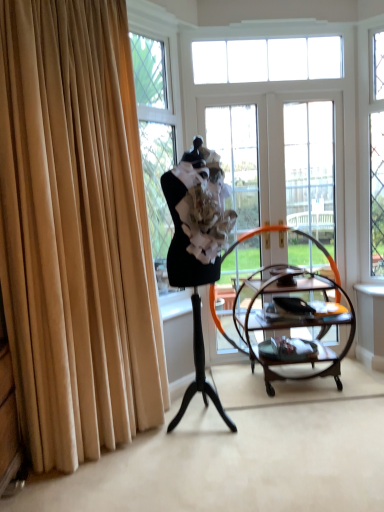
Identify the location of black matte mannequin at center. (196, 248).

At what (x,y) coordinates should I click in order to perform the action: click on mahogany wood serving cart at center. Please return your answer as a coordinate pair (x, y). This screenshot has width=384, height=512. Looking at the image, I should click on (292, 323).

What do you see at coordinates (277, 160) in the screenshot? Image resolution: width=384 pixels, height=512 pixels. I see `clear glass door at center, which is the second glass door from right to left` at bounding box center [277, 160].

Find the location of a particular element. The height and width of the screenshot is (512, 384). black matte mannequin at center is located at coordinates (196, 248).

Is beige velvet curtain at left facing away from black matte mannequin at center?

That's not correct — beige velvet curtain at left is not looking away from black matte mannequin at center.

Is beige velvet curtain at left inside the boundaries of black matte mannequin at center, or outside?

beige velvet curtain at left lies outside black matte mannequin at center.

What's the angular difference between beige velvet curtain at left and black matte mannequin at center's facing directions?

15.3 degrees.

In the scene shown: From a real-world perspective, is beige velvet curtain at left positioned above or below black matte mannequin at center?

In terms of real-world spatial position, beige velvet curtain at left is above black matte mannequin at center.

Who is taller, black matte mannequin at center or clear glass door at center, the second glass door from the left?

With more height is clear glass door at center, the second glass door from the left.

Would you say clear glass door at center, arranged as the first glass door when viewed from the right, is part of black matte mannequin at center's contents?

Definitely not — clear glass door at center, arranged as the first glass door when viewed from the right, is not inside black matte mannequin at center.

Which of these two, black matte mannequin at center or clear glass door at center, arranged as the first glass door when viewed from the right, is wider?

Wider between the two is black matte mannequin at center.

Is clear glass door at center, which is the second glass door from right to left, inside the boundaries of mahogany wood serving cart at center, or outside?

The correct answer is: outside.

Is clear glass door at center, which is the second glass door from right to left, facing away from mahogany wood serving cart at center?

Yes, clear glass door at center, which is the second glass door from right to left, is facing away from mahogany wood serving cart at center.

From a real-world perspective, is clear glass door at center, acting as the 1th glass door starting from the left, positioned over mahogany wood serving cart at center based on gravity?

Yes, from a real-world perspective, clear glass door at center, acting as the 1th glass door starting from the left, is on top of mahogany wood serving cart at center.

How far apart are black matte mannequin at center and clear glass door at center, acting as the 1th glass door starting from the left?

The distance of black matte mannequin at center from clear glass door at center, acting as the 1th glass door starting from the left, is 88.82 centimeters.

Is clear glass door at center, which is the second glass door from right to left, completely or partially inside black matte mannequin at center?

No, black matte mannequin at center does not contain clear glass door at center, which is the second glass door from right to left.

Looking at this image, considering the sizes of objects black matte mannequin at center and clear glass door at center, acting as the 1th glass door starting from the left, in the image provided, who is taller, black matte mannequin at center or clear glass door at center, acting as the 1th glass door starting from the left,?

With more height is clear glass door at center, acting as the 1th glass door starting from the left.

From the picture: Who is smaller, black matte mannequin at center or clear glass door at center, which is the second glass door from right to left?

clear glass door at center, which is the second glass door from right to left, is smaller.

Is clear glass door at center, acting as the 1th glass door starting from the left, directly adjacent to black matte mannequin at center?

clear glass door at center, acting as the 1th glass door starting from the left, and black matte mannequin at center are not in contact.

Which point is more distant from viewer, [269,212] or [190,204]?

The point [269,212] is farther from the camera.

Looking at this image, can you confirm if clear glass door at center, which is the second glass door from right to left, is smaller than black matte mannequin at center?

Correct, clear glass door at center, which is the second glass door from right to left, occupies less space than black matte mannequin at center.

From the image's perspective, which one is positioned lower, clear glass door at center, acting as the 1th glass door starting from the left, or black matte mannequin at center?

black matte mannequin at center appears lower in the image.

Looking at this image, how far apart are mahogany wood serving cart at center and clear glass door at center, the second glass door from the left?

mahogany wood serving cart at center is 61.76 centimeters away from clear glass door at center, the second glass door from the left.

Where is `table that appears below the clear glass door at center, the second glass door from the left (from a real-world perspective)`? table that appears below the clear glass door at center, the second glass door from the left (from a real-world perspective) is located at coordinates (292, 323).

Considering the sizes of objects mahogany wood serving cart at center and clear glass door at center, the second glass door from the left, in the image provided, who is bigger, mahogany wood serving cart at center or clear glass door at center, the second glass door from the left,?

mahogany wood serving cart at center is bigger.

In terms of width, does mahogany wood serving cart at center look wider or thinner when compared to clear glass door at center, the second glass door from the left?

In the image, mahogany wood serving cart at center appears to be wider than clear glass door at center, the second glass door from the left.

How many degrees apart are the facing directions of clear glass door at center, which is the second glass door from right to left, and clear glass window at upper center?

0.00539 degrees.

From a real-world perspective, is clear glass door at center, acting as the 1th glass door starting from the left, under clear glass window at upper center?

Yes.

Which is correct: clear glass door at center, acting as the 1th glass door starting from the left, is inside clear glass window at upper center, or outside of it?

clear glass door at center, acting as the 1th glass door starting from the left, is outside clear glass window at upper center.

In terms of height, does clear glass door at center, which is the second glass door from right to left, look taller or shorter compared to clear glass window at upper center?

Clearly, clear glass door at center, which is the second glass door from right to left, is taller compared to clear glass window at upper center.

Image resolution: width=384 pixels, height=512 pixels. In order to click on woman below the beige velvet curtain at left (from a real-world perspective) in this screenshot , I will do `click(196, 248)`.

At what (x,y) coordinates should I click in order to perform the action: click on the 1st glass door above when counting from the black matte mannequin at center (from the image's perspective). Please return your answer as a coordinate pair (x, y). Image resolution: width=384 pixels, height=512 pixels. Looking at the image, I should click on (310, 181).

Considering their positions, is mahogany wood serving cart at center positioned further to clear glass door at center, the second glass door from the left, than black matte mannequin at center?

Based on the image, black matte mannequin at center appears to be further to clear glass door at center, the second glass door from the left.

Which object lies further to the anchor point beige velvet curtain at left, clear glass door at center, which is the second glass door from right to left, or clear glass window at upper center?

Based on the image, clear glass window at upper center appears to be further to beige velvet curtain at left.

Estimate the real-world distances between objects in this image. Which object is further from beige velvet curtain at left, clear glass door at center, the second glass door from the left, or mahogany wood serving cart at center?

clear glass door at center, the second glass door from the left, lies further to beige velvet curtain at left than the other object.

From the image, which object appears to be nearer to black matte mannequin at center, beige velvet curtain at left or clear glass door at center, which is the second glass door from right to left?

beige velvet curtain at left is positioned closer to the anchor black matte mannequin at center.

From the image, which object appears to be farther from clear glass door at center, acting as the 1th glass door starting from the left, clear glass window at upper center or mahogany wood serving cart at center?

clear glass window at upper center lies further to clear glass door at center, acting as the 1th glass door starting from the left, than the other object.

Considering their positions, is beige velvet curtain at left positioned closer to clear glass window at upper center than black matte mannequin at center?

black matte mannequin at center lies closer to clear glass window at upper center than the other object.

Looking at the image, which one is located further to clear glass door at center, which is the second glass door from right to left, clear glass window at upper center or beige velvet curtain at left?

beige velvet curtain at left is positioned further to the anchor clear glass door at center, which is the second glass door from right to left.

Based on their spatial positions, is clear glass window at upper center or clear glass door at center, the second glass door from the left, further from beige velvet curtain at left?

clear glass door at center, the second glass door from the left, is positioned further to the anchor beige velvet curtain at left.

This screenshot has width=384, height=512. Identify the location of table between black matte mannequin at center and clear glass door at center, the second glass door from the left, along the z-axis. (292, 323).

Identify the location of window located between beige velvet curtain at left and clear glass door at center, arranged as the first glass door when viewed from the right, in the depth direction. Image resolution: width=384 pixels, height=512 pixels. (267, 60).

This screenshot has width=384, height=512. I want to click on glass door that lies between clear glass window at upper center and clear glass door at center, the second glass door from the left, from top to bottom, so click(x=277, y=160).

Locate an element on the screen. This screenshot has width=384, height=512. woman between beige velvet curtain at left and clear glass door at center, which is the second glass door from right to left, in the front-back direction is located at coordinates (196, 248).